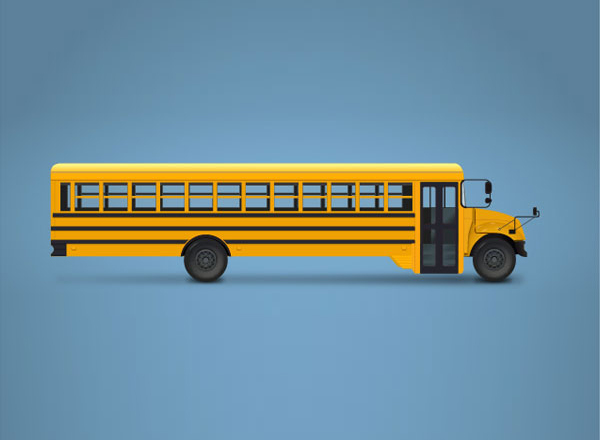
Locate an element on the screen. lower left quadrant of door is located at coordinates (430, 251).